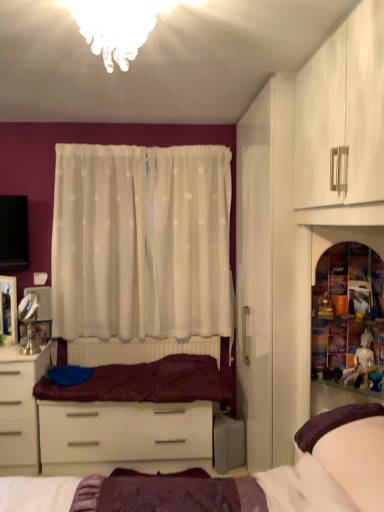
Where is `vacant space situated above white sheer curtain at center (from a real-world perspective)`? Image resolution: width=384 pixels, height=512 pixels. vacant space situated above white sheer curtain at center (from a real-world perspective) is located at coordinates (144, 144).